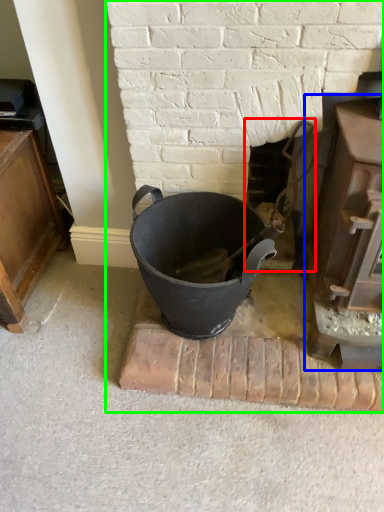
Question: Which is nearer to the fireplace (highlighted by a red box)? fireplace (highlighted by a blue box) or fireplace (highlighted by a green box).

Choices:
 (A) fireplace
 (B) fireplace

Answer: (B)